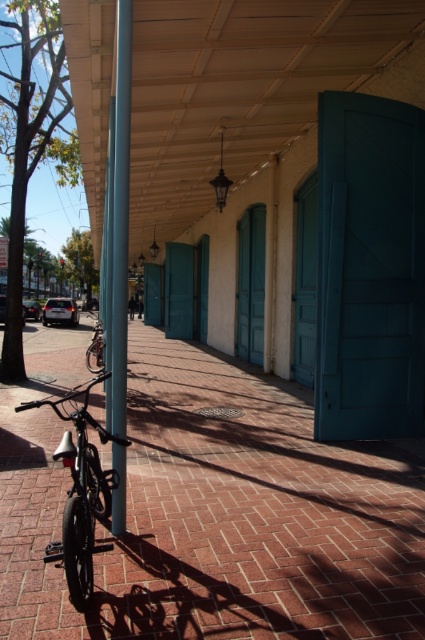
You are a delivery person who needs to park your shiny black bicycle at center and shiny silver bicycle at center in a small parking area. Which bicycle should you park first to fit both?

You should park the shiny black bicycle at center first since it occupies less space than the shiny silver bicycle at center, allowing both to fit in the parking area.

You are standing on the covered walkway and want to move from the metallic silver pole at center to the shiny black bicycle at center. Which direction should you move to get closer to the bicycle?

You should move away from the metallic silver pole at center towards the shiny black bicycle at center because the pole is closer to you than the bicycle, so moving forward in the direction of the bicycle will bring you closer.

You are a delivery person trying to park your shiny silver bicycle at center near the metallic silver pole at center. Can you fit both the bicycle and the pole in the space between them if the pole is thinner than the bicycle?

The metallic silver pole at center is thinner than the shiny silver bicycle at center, so there should be enough space to fit both as the pole takes up less width than the bicycle.